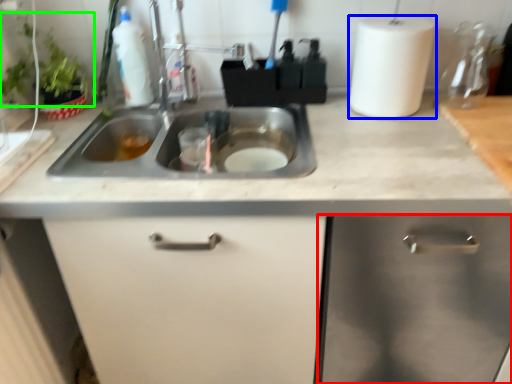
Question: Based on their relative distances, which object is nearer to cabinetry (highlighted by a red box)? Choose from paper towel (highlighted by a blue box) and plant (highlighted by a green box).

Choices:
 (A) paper towel
 (B) plant

Answer: (A)